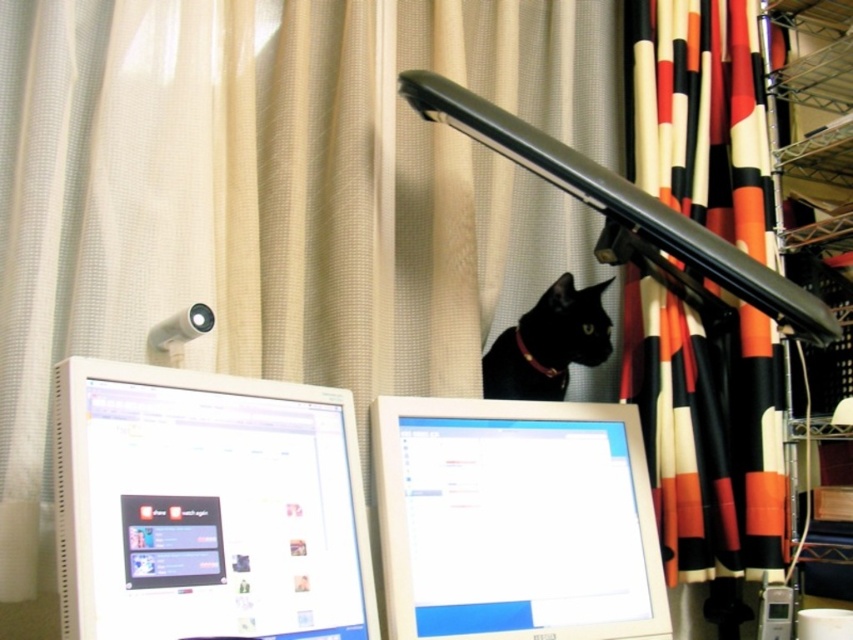
Question: Considering the relative positions of black and white striped curtain at right and black glossy cat at upper center in the image provided, where is black and white striped curtain at right located with respect to black glossy cat at upper center?

Choices:
 (A) below
 (B) above

Answer: (B)

Question: Which is farther from the white glossy computer monitor at lower left?

Choices:
 (A) black glossy cat at upper center
 (B) white glossy computer monitor at center

Answer: (A)

Question: Which object is the farthest from the black glossy cat at upper center?

Choices:
 (A) white glossy computer monitor at center
 (B) black and white striped curtain at right

Answer: (A)

Question: Among these objects, which one is farthest from the camera?

Choices:
 (A) white glossy computer monitor at lower left
 (B) black glossy cat at upper center
 (C) black and white striped curtain at right
 (D) white glossy computer monitor at center

Answer: (B)

Question: Can you confirm if white glossy computer monitor at lower left is positioned to the left of white glossy computer monitor at center?

Choices:
 (A) yes
 (B) no

Answer: (A)

Question: Is white glossy computer monitor at lower left bigger than black glossy cat at upper center?

Choices:
 (A) yes
 (B) no

Answer: (A)